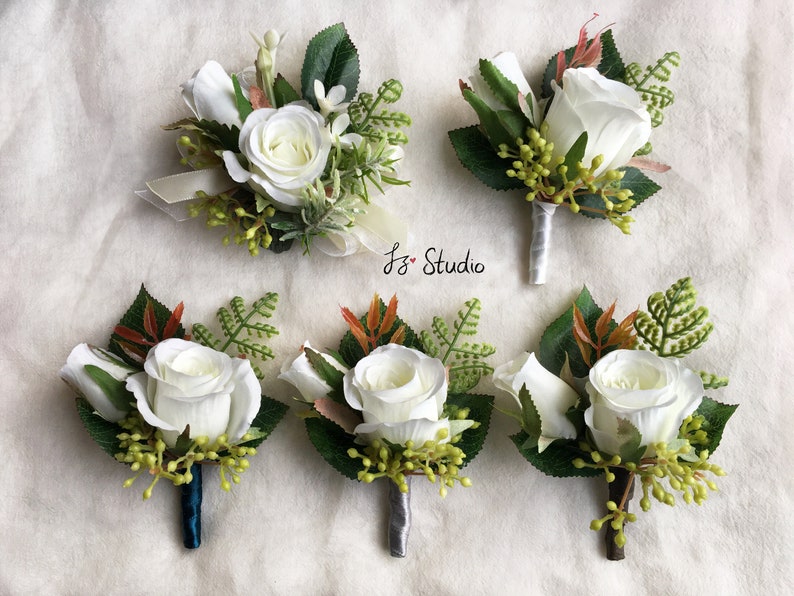
Where is `flower bouquet`? flower bouquet is located at coordinates (198, 390), (411, 431), (629, 432), (576, 164), (322, 167).